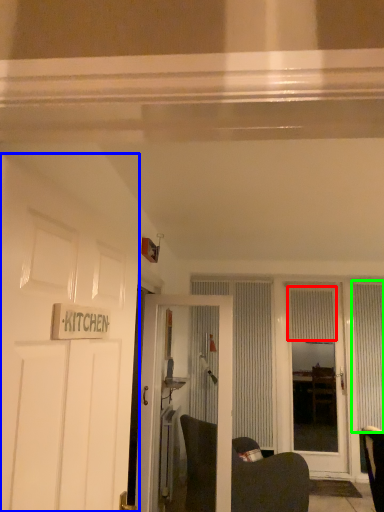
Question: Considering the real-world distances, which object is farthest from curtain (highlighted by a red box)? door (highlighted by a blue box) or curtain (highlighted by a green box)?

Choices:
 (A) door
 (B) curtain

Answer: (A)